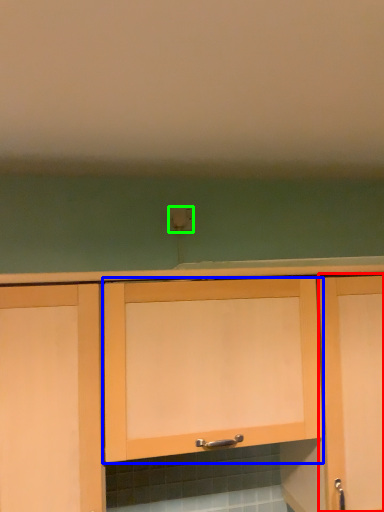
Question: Based on their relative distances, which object is farther from cabinetry (highlighted by a red box)? Choose from cabinetry (highlighted by a blue box) and electric outlet (highlighted by a green box).

Choices:
 (A) cabinetry
 (B) electric outlet

Answer: (B)